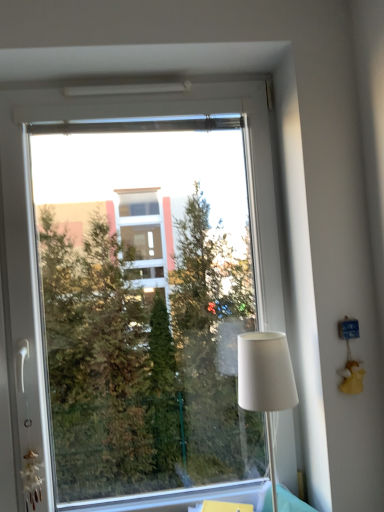
You are a GUI agent. You are given a task and a screenshot of the screen. Output one action in this format:
    pyautogui.click(x=<x>, y=<y>)
    Task: Click on the white fabric lampshade at right
    This screenshot has width=384, height=512.
    Given the screenshot: What is the action you would take?
    pyautogui.click(x=266, y=381)

Image resolution: width=384 pixels, height=512 pixels. Describe the element at coordinates (266, 381) in the screenshot. I see `white fabric lampshade at right` at that location.

Measure the distance between point (x=263, y=354) and camera.

The depth of point (x=263, y=354) is 1.13 meters.

What is the approximate width of transparent glass window at center?

transparent glass window at center is 5.68 inches in width.

Where is `transparent glass window at center`? transparent glass window at center is located at coordinates (136, 290).

What do you see at coordinates (136, 290) in the screenshot? Image resolution: width=384 pixels, height=512 pixels. I see `transparent glass window at center` at bounding box center [136, 290].

Image resolution: width=384 pixels, height=512 pixels. I want to click on white fabric lampshade at right, so click(266, 381).

Does white fabric lampshade at right appear on the right side of transparent glass window at center?

Indeed, white fabric lampshade at right is positioned on the right side of transparent glass window at center.

Considering their positions, is white fabric lampshade at right located in front of or behind transparent glass window at center?

Clearly, white fabric lampshade at right is in front of transparent glass window at center.

Between point (271, 364) and point (80, 400), which one is positioned in front?

The point (271, 364) is in front.

From the image's perspective, which is below, white fabric lampshade at right or transparent glass window at center?

white fabric lampshade at right is shown below in the image.

From a real-world perspective, is white fabric lampshade at right positioned over transparent glass window at center based on gravity?

Actually, white fabric lampshade at right is physically below transparent glass window at center in the real world.

Which object is thinner, white fabric lampshade at right or transparent glass window at center?

transparent glass window at center is thinner.

Looking at this image, who is taller, white fabric lampshade at right or transparent glass window at center?

Standing taller between the two is transparent glass window at center.

Considering the sizes of objects white fabric lampshade at right and transparent glass window at center in the image provided, who is bigger, white fabric lampshade at right or transparent glass window at center?

Bigger between the two is transparent glass window at center.

Is white fabric lampshade at right inside the boundaries of transparent glass window at center, or outside?

white fabric lampshade at right is not enclosed by transparent glass window at center.

Is white fabric lampshade at right far away from transparent glass window at center?

white fabric lampshade at right is far away from transparent glass window at center.

Based on the photo, is white fabric lampshade at right aimed at transparent glass window at center?

No, white fabric lampshade at right does not turn towards transparent glass window at center.

Based on the photo, how far apart are white fabric lampshade at right and transparent glass window at center?

white fabric lampshade at right and transparent glass window at center are 3.17 meters apart from each other.

You are a GUI agent. You are given a task and a screenshot of the screen. Output one action in this format:
    pyautogui.click(x=<x>, y=<y>)
    Task: Click on the window that is above the white fabric lampshade at right (from the image's perspective)
    
    Given the screenshot: What is the action you would take?
    tap(136, 290)

Is transparent glass window at center to the left of white fabric lampshade at right from the viewer's perspective?

Yes, transparent glass window at center is to the left of white fabric lampshade at right.

Considering the positions of objects transparent glass window at center and white fabric lampshade at right in the image provided, who is behind, transparent glass window at center or white fabric lampshade at right?

transparent glass window at center is more distant.

Considering the points (209, 190) and (248, 335), which point is in front, point (209, 190) or point (248, 335)?

The point (248, 335) is more forward.

From the image's perspective, which object appears higher, transparent glass window at center or white fabric lampshade at right?

transparent glass window at center appears higher in the image.

Consider the image. From a real-world perspective, between transparent glass window at center and white fabric lampshade at right, who is vertically higher?

From a 3D spatial view, transparent glass window at center is above.

Does transparent glass window at center have a greater width compared to white fabric lampshade at right?

No.

Who is shorter, transparent glass window at center or white fabric lampshade at right?

With less height is white fabric lampshade at right.

Considering the relative sizes of transparent glass window at center and white fabric lampshade at right in the image provided, is transparent glass window at center bigger than white fabric lampshade at right?

Yes.

Is transparent glass window at center inside the boundaries of white fabric lampshade at right, or outside?

transparent glass window at center is located beyond the bounds of white fabric lampshade at right.

Is transparent glass window at center placed right next to white fabric lampshade at right?

transparent glass window at center and white fabric lampshade at right are not in contact.

Is white fabric lampshade at right at the back of transparent glass window at center?

Absolutely, transparent glass window at center is directed away from white fabric lampshade at right.

How many degrees apart are the facing directions of transparent glass window at center and white fabric lampshade at right?

8.04e-05 degrees.

At what (x,y) coordinates should I click in order to perform the action: click on window behind the white fabric lampshade at right. Please return your answer as a coordinate pair (x, y). Looking at the image, I should click on (136, 290).

Image resolution: width=384 pixels, height=512 pixels. Identify the location of window to the left of white fabric lampshade at right. (136, 290).

Locate an element on the screen. The image size is (384, 512). window above the white fabric lampshade at right (from a real-world perspective) is located at coordinates (136, 290).